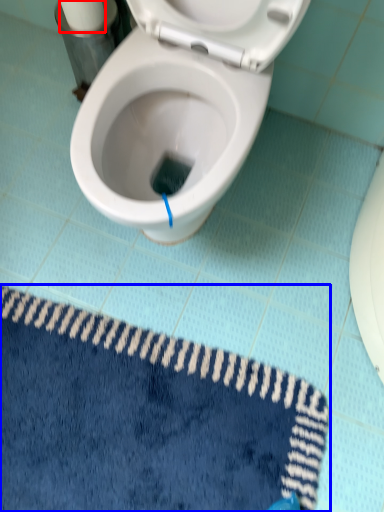
Question: Which object appears farthest to the camera in this image, toilet paper (highlighted by a red box) or bath mat (highlighted by a blue box)?

Choices:
 (A) toilet paper
 (B) bath mat

Answer: (A)